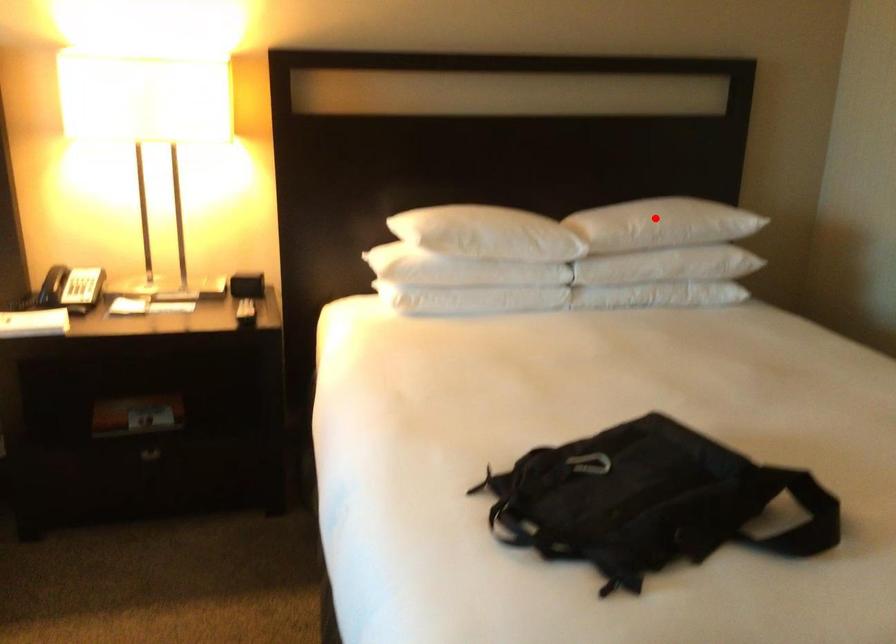
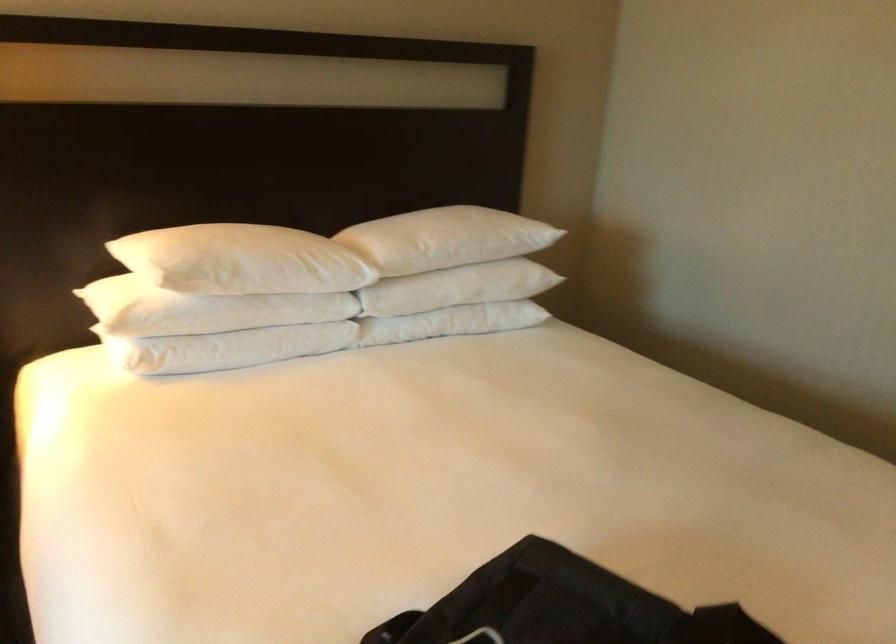
Locate, in the second image, the point that corresponds to the highlighted location in the first image.

(449, 238)